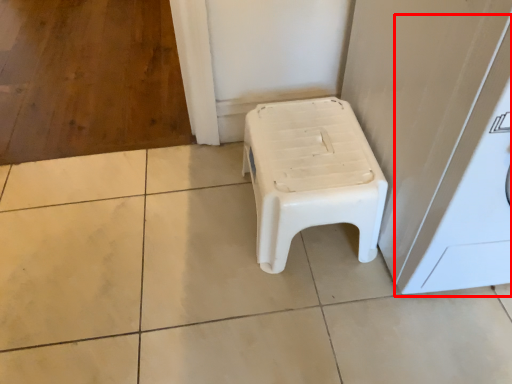
Question: Observing the image, what is the correct spatial positioning of washing machine (annotated by the red box) in reference to stool?

Choices:
 (A) right
 (B) left

Answer: (A)